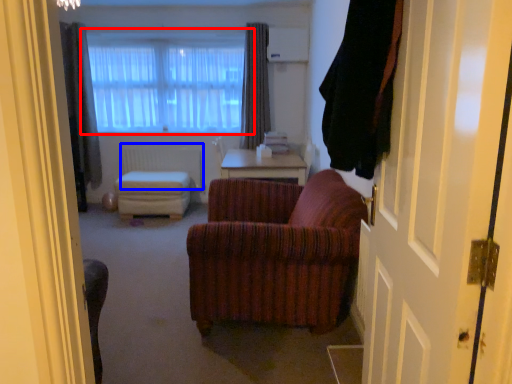
Question: Which object is further to the camera taking this photo, window (highlighted by a red box) or radiator (highlighted by a blue box)?

Choices:
 (A) window
 (B) radiator

Answer: (B)